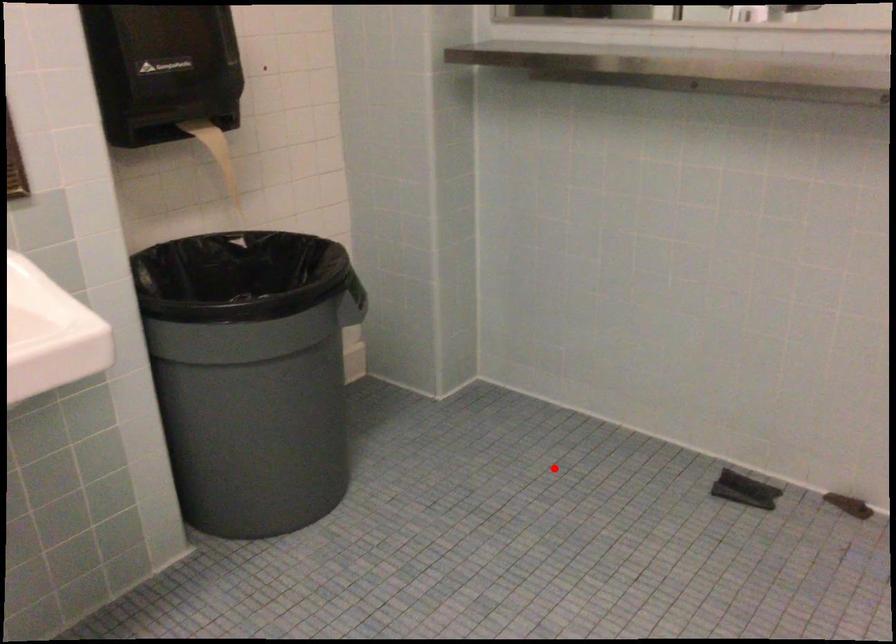
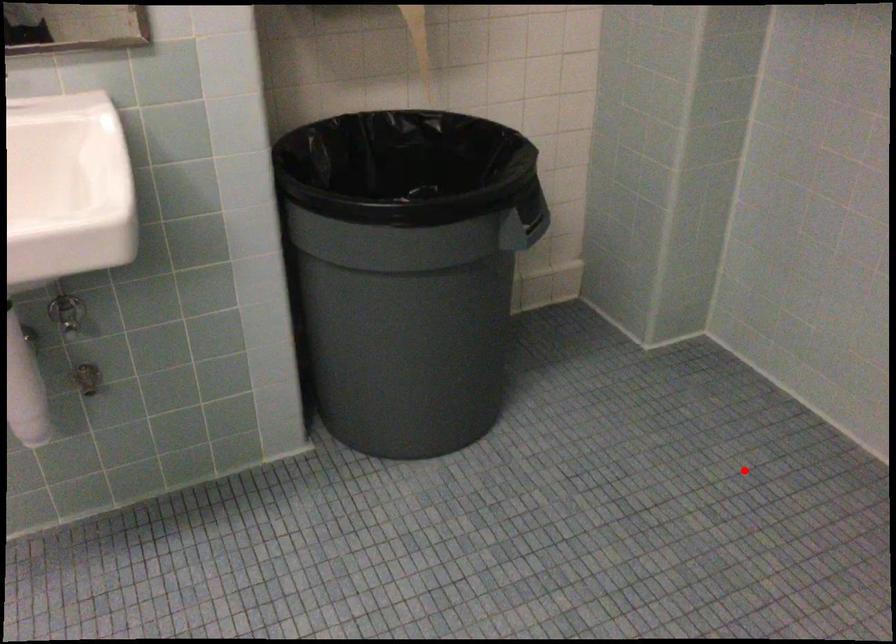
I am providing you with two images of the same scene from different viewpoints. A red point is marked on the first image and another point is marked on the second image. Is the marked point in image1 the same physical position as the marked point in image2?

Yes